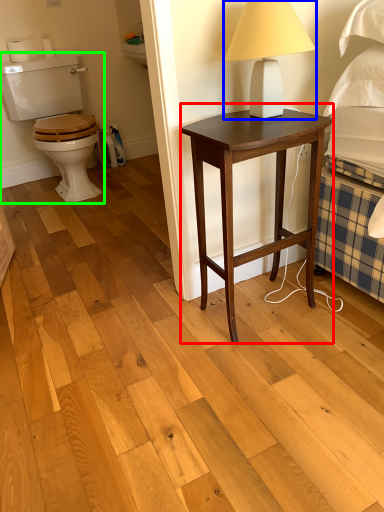
Question: Based on their relative distances, which object is farther from nightstand (highlighted by a red box)? Choose from table lamp (highlighted by a blue box) and sit (highlighted by a green box).

Choices:
 (A) table lamp
 (B) sit

Answer: (B)